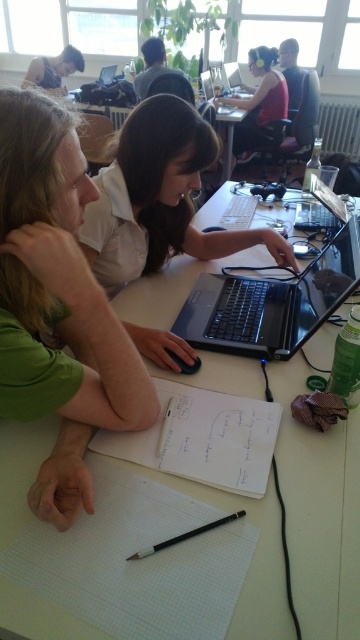
Question: Does white matte table at center appear on the right side of green matte shirt at left?

Choices:
 (A) yes
 (B) no

Answer: (A)

Question: Which object is the farthest from the matte black headphones at upper center?

Choices:
 (A) green matte shirt at left
 (B) black plastic laptop at center
 (C) matte black laptop at upper center

Answer: (A)

Question: Is green matte shirt at left to the right of matte black laptop at center from the viewer's perspective?

Choices:
 (A) yes
 (B) no

Answer: (B)

Question: Can you confirm if matte black laptop at center is smaller than matte black laptop at upper center?

Choices:
 (A) no
 (B) yes

Answer: (B)

Question: Which point is farther from the camera taking this photo?

Choices:
 (A) (218, 387)
 (B) (33, 205)
 (C) (156, 243)

Answer: (C)

Question: Which of the following is the farthest from the observer?

Choices:
 (A) (163, 148)
 (B) (276, 108)
 (C) (33, 76)
 (D) (257, 371)

Answer: (C)